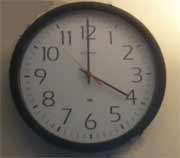
At what (x,y) coordinates should I click in order to perform the action: click on black clock rim. Please return your answer as a coordinate pair (x, y). Looking at the image, I should click on (133, 134).